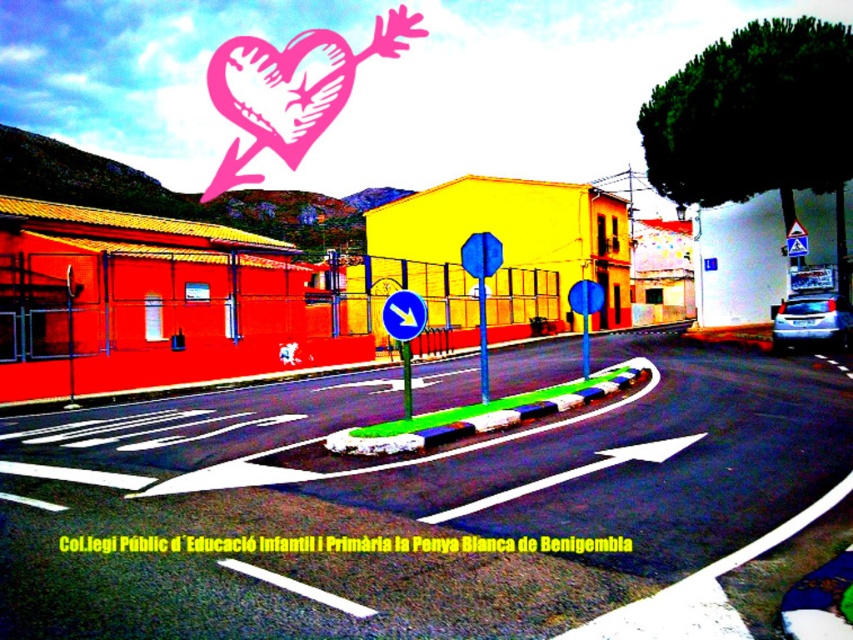
You are a pedestrian standing at the intersection and notice a pink paper heart at upper center and a blue plastic traffic sign at center. Which object is positioned higher in the image?

The pink paper heart at upper center is located above the blue plastic traffic sign at center, so it is positioned higher.

You are a delivery drone that needs to deliver a package to the pink paper heart at upper center. The blue plastic traffic sign at center might block your path. Can you fly over it without any issues?

The pink paper heart at upper center is bigger than the blue plastic traffic sign at center, so the blue plastic traffic sign at center is smaller. Since the blue plastic traffic sign at center is smaller, the drone can likely fly over it without any issues.

You are an artist creating a mural and want to ensure proper scaling. If the blue plastic traffic sign at center is 30 cm wide, what is the minimum width required for the pink paper heart at upper center to maintain the correct size relationship?

The pink paper heart at upper center must be wider than 30 cm to maintain the correct size relationship since it is described as larger in width than the blue plastic traffic sign at center.